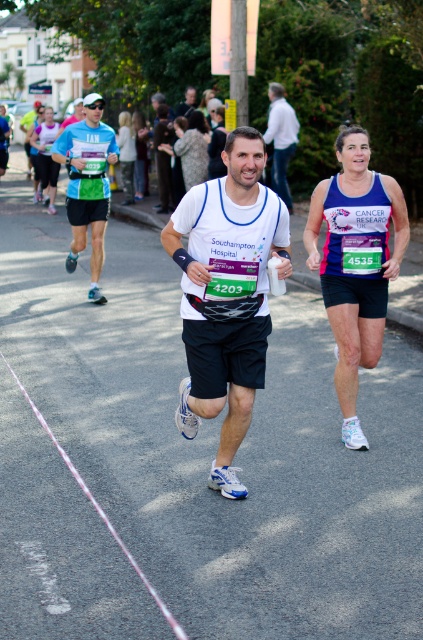
From the picture: Which of these two, matte purple tank top at right or matte blue shorts at left, stands taller?

matte blue shorts at left is taller.

Between point (345, 353) and point (91, 180), which one is positioned in front?

Point (345, 353)

Is point (346, 355) closer to camera compared to point (84, 120)?

Yes, point (346, 355) is in front of point (84, 120).

This screenshot has width=423, height=640. What are the coordinates of `matte purple tank top at right` in the screenshot? It's located at (356, 262).

Does white matte shirt at center have a lesser width compared to matte black shirt at center?

In fact, white matte shirt at center might be wider than matte black shirt at center.

Who is shorter, white matte shirt at center or matte black shirt at center?

With less height is matte black shirt at center.

Is point (277, 144) positioned in front of point (181, 106)?

Yes, it is.

Find the location of a particular element. The height and width of the screenshot is (640, 423). white matte shirt at center is located at coordinates (280, 140).

Can you confirm if white matte running shirt at center is smaller than white matte shirt at center?

Yes, white matte running shirt at center is smaller than white matte shirt at center.

Does white matte running shirt at center have a lesser width compared to white matte shirt at center?

No.

This screenshot has width=423, height=640. I want to click on white matte running shirt at center, so pos(227,294).